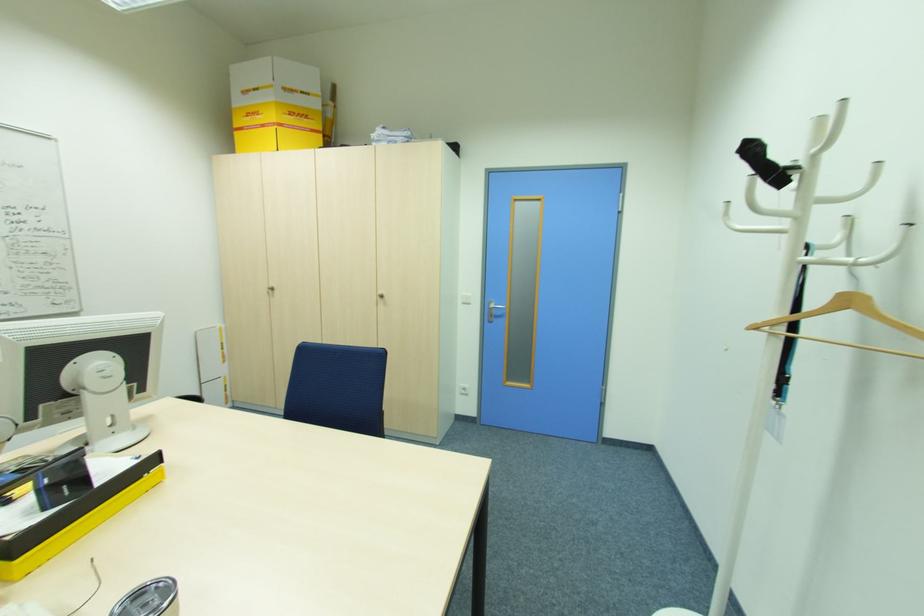
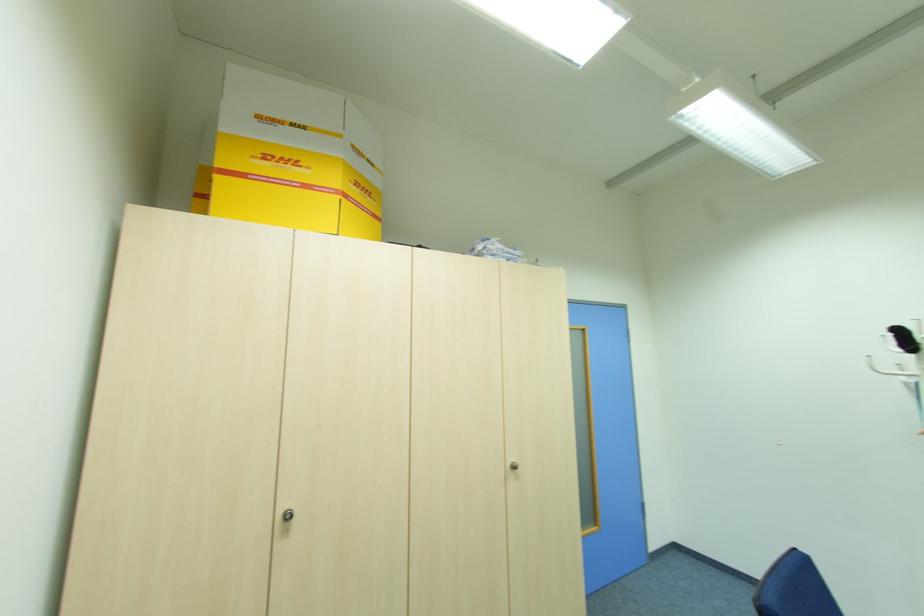
Where in the second image is the point corresponding to point 383,293 from the first image?

(513, 460)